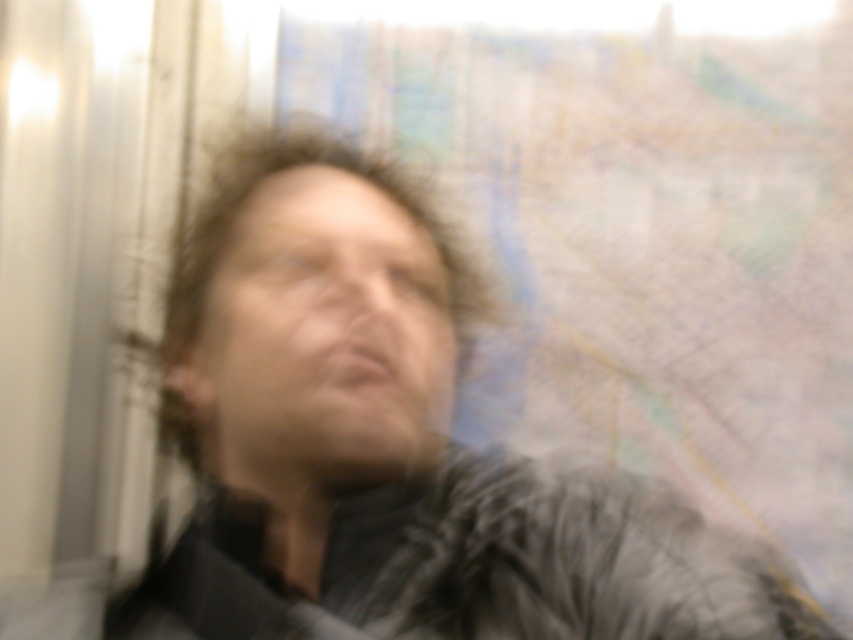
Question: Does dark gray fur coat at center have a lesser width compared to dark gray textured jacket at center?

Choices:
 (A) yes
 (B) no

Answer: (B)

Question: Where is dark gray fur coat at center located in relation to matte black face at center in the image?

Choices:
 (A) above
 (B) below

Answer: (B)

Question: Based on their relative distances, which object is farther from the matte black face at center?

Choices:
 (A) dark gray textured jacket at center
 (B) dark gray fur coat at center

Answer: (A)

Question: Which point is farther to the camera?

Choices:
 (A) (345, 276)
 (B) (451, 612)
 (C) (306, 620)

Answer: (A)

Question: Does dark gray fur coat at center appear under matte black face at center?

Choices:
 (A) no
 (B) yes

Answer: (B)

Question: Which point appears closest to the camera in this image?

Choices:
 (A) (734, 579)
 (B) (376, 204)

Answer: (A)